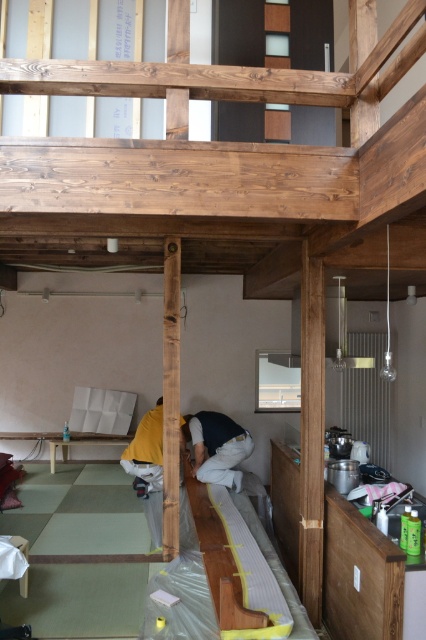
Question: Estimate the real-world distances between objects in this image. Which object is farther from the smooth wood beam at center?

Choices:
 (A) wooden bed at lower center
 (B) yellow fabric at lower center
 (C) dark blue fabric at center

Answer: (C)

Question: Does smooth wood beam at center have a lesser width compared to dark blue fabric at center?

Choices:
 (A) yes
 (B) no

Answer: (A)

Question: Is wooden bed at lower center bigger than smooth wood beam at center?

Choices:
 (A) no
 (B) yes

Answer: (B)

Question: Which point is closer to the camera?

Choices:
 (A) (239, 573)
 (B) (224, 420)

Answer: (A)

Question: Which object appears closest to the camera in this image?

Choices:
 (A) dark blue fabric at center
 (B) yellow fabric at lower center
 (C) wooden bed at lower center

Answer: (C)

Question: Can you confirm if wooden bed at lower center is smaller than smooth wood beam at center?

Choices:
 (A) yes
 (B) no

Answer: (B)